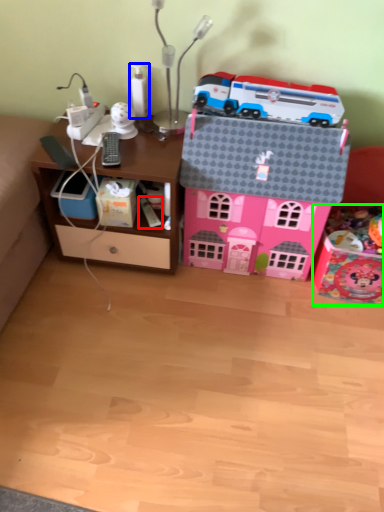
Question: Which is farther away from toy (highlighted by a red box)? toy (highlighted by a blue box) or toy (highlighted by a green box)?

Choices:
 (A) toy
 (B) toy

Answer: (B)